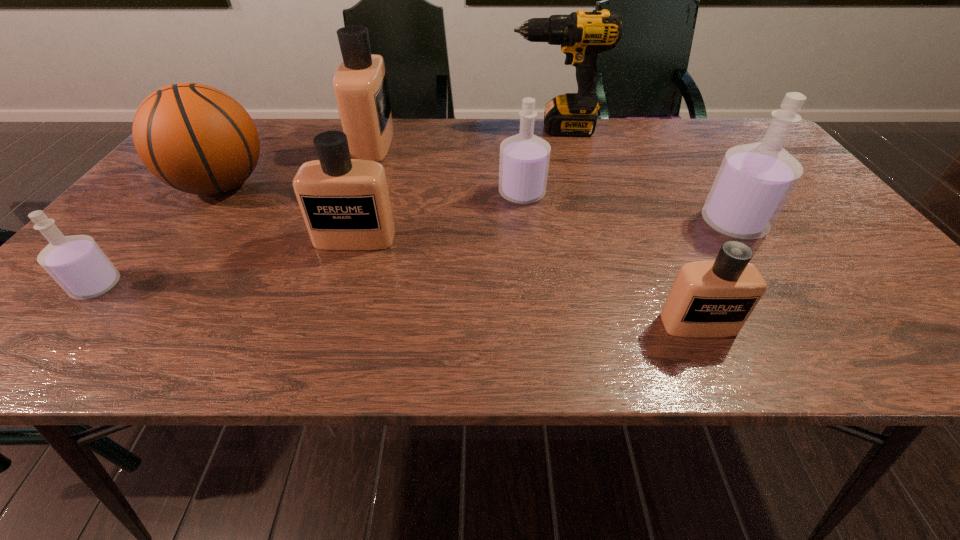
The width and height of the screenshot is (960, 540). What are the coordinates of `black drill` in the screenshot? It's located at [x=582, y=35].

Locate an element on the screen. The height and width of the screenshot is (540, 960). the farthest beige perfume is located at coordinates (360, 85).

The height and width of the screenshot is (540, 960). In order to click on the biggest beige perfume in this screenshot , I will do `click(360, 85)`.

Where is `the biggest purple perfume`? This screenshot has width=960, height=540. the biggest purple perfume is located at coordinates 754,182.

Identify the location of the rightmost perfume. (754, 182).

Find the location of a particular element. The width and height of the screenshot is (960, 540). basketball is located at coordinates (195, 138).

Locate an element on the screen. The image size is (960, 540). the second purple perfume from left to right is located at coordinates (524, 158).

The width and height of the screenshot is (960, 540). What are the coordinates of `the fourth perfume from left to right` in the screenshot? It's located at 524,158.

This screenshot has height=540, width=960. Identify the location of the second farthest beige perfume. (345, 203).

Locate an element on the screen. The width and height of the screenshot is (960, 540). the seventh farthest object is located at coordinates (80, 267).